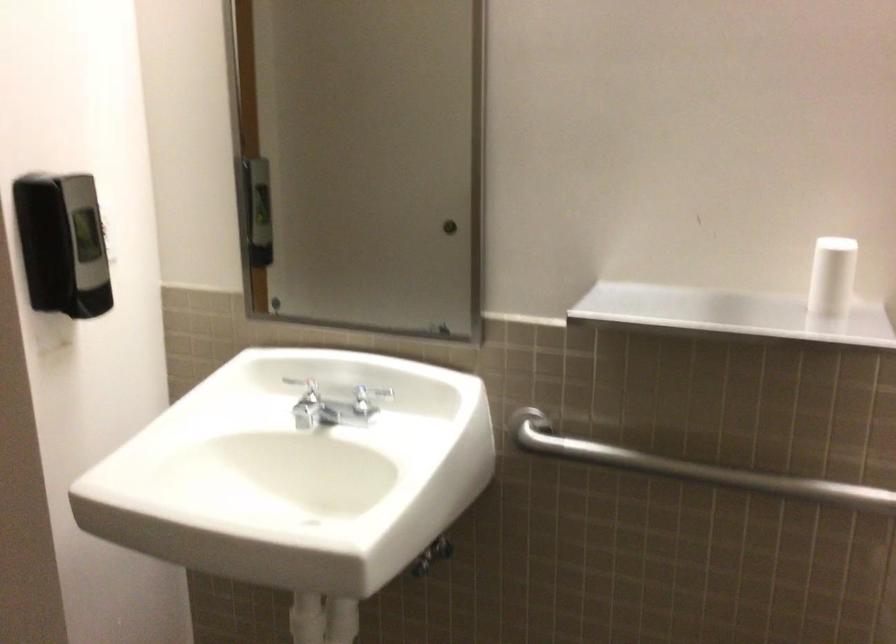
Where would you pull the cabinet handle? Please return your answer as a coordinate pair (x, y).

(444, 218)